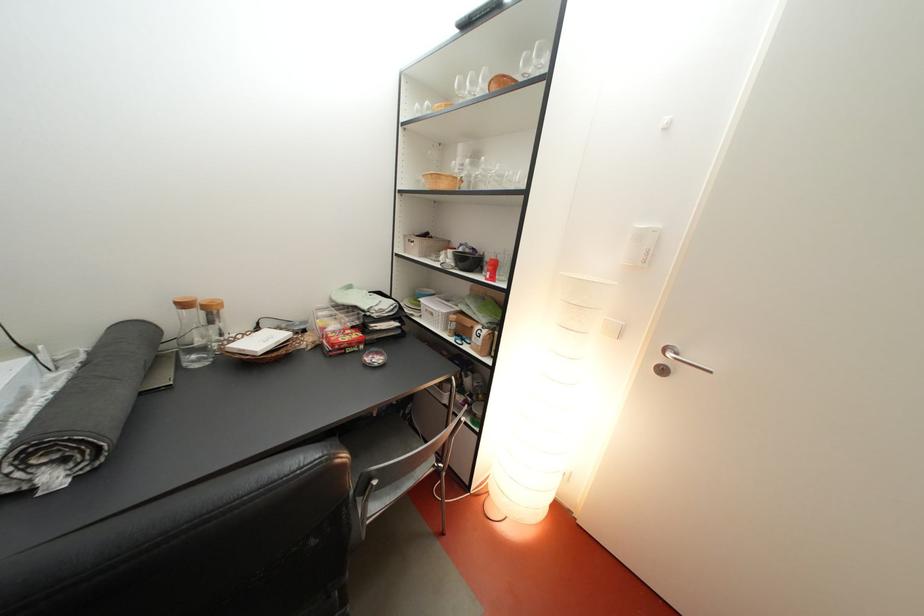
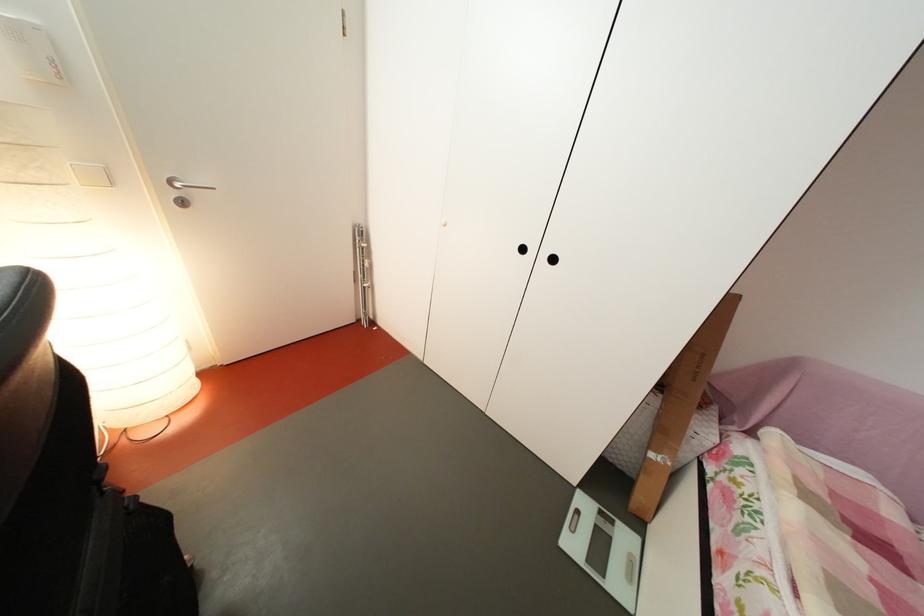
The first image is from the beginning of the video and the second image is from the end. How did the camera likely rotate when shooting the video?

The camera rotated toward right-down.